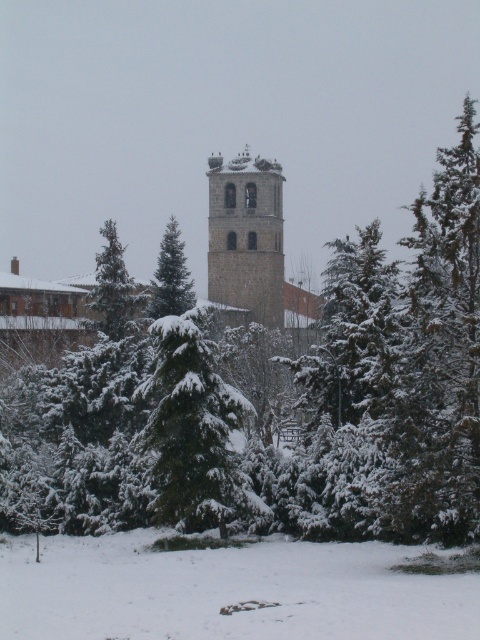
Who is positioned more to the right, white fluffy snow at lower center or green snow-covered tree at center?

white fluffy snow at lower center

Does white fluffy snow at lower center have a larger size compared to green snow-covered tree at center?

Correct, white fluffy snow at lower center is larger in size than green snow-covered tree at center.

Between point (415, 628) and point (136, 307), which one is positioned in front?

Point (415, 628)

Where is `white fluffy snow at lower center`? This screenshot has width=480, height=640. white fluffy snow at lower center is located at coordinates [226, 589].

Is snow-covered evergreen at center above green textured pine tree at center?

No.

Is snow-covered evergreen at center smaller than green textured pine tree at center?

No.

Measure the distance between point (232,461) and camera.

Point (232,461) and camera are 57.41 meters apart.

You are a GUI agent. You are given a task and a screenshot of the screen. Output one action in this format:
    pyautogui.click(x=<x>, y=<y>)
    Task: Click on the snow-covered evergreen at center
    
    Given the screenshot: What is the action you would take?
    pyautogui.click(x=192, y=432)

Is point (247, 561) less distant than point (168, 285)?

Yes, it is.

Which is above, white fluffy snow at lower center or green textured pine tree at center?

green textured pine tree at center is higher up.

Between point (31, 600) and point (164, 272), which one is positioned in front?

Point (31, 600) is in front.

The width and height of the screenshot is (480, 640). Identify the location of white fluffy snow at lower center. (226, 589).